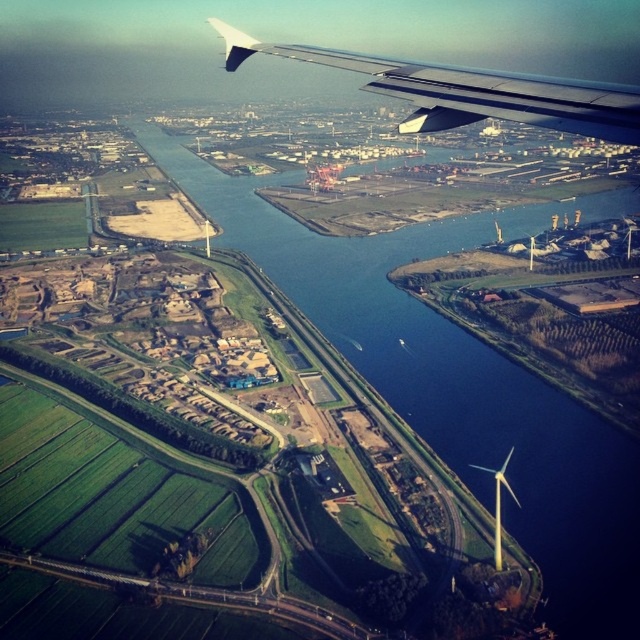
Question: Among these points, which one is farthest from the camera?

Choices:
 (A) (449, 124)
 (B) (528, 428)

Answer: (B)

Question: Is blue water at lower left positioned at the back of metallic gray wing at upper right?

Choices:
 (A) no
 (B) yes

Answer: (B)

Question: Which point appears farthest from the camera in this image?

Choices:
 (A) (548, 516)
 (B) (547, 125)

Answer: (A)

Question: Is blue water at lower left in front of metallic gray wing at upper right?

Choices:
 (A) yes
 (B) no

Answer: (B)

Question: Can you confirm if blue water at lower left is positioned above metallic gray wing at upper right?

Choices:
 (A) no
 (B) yes

Answer: (A)